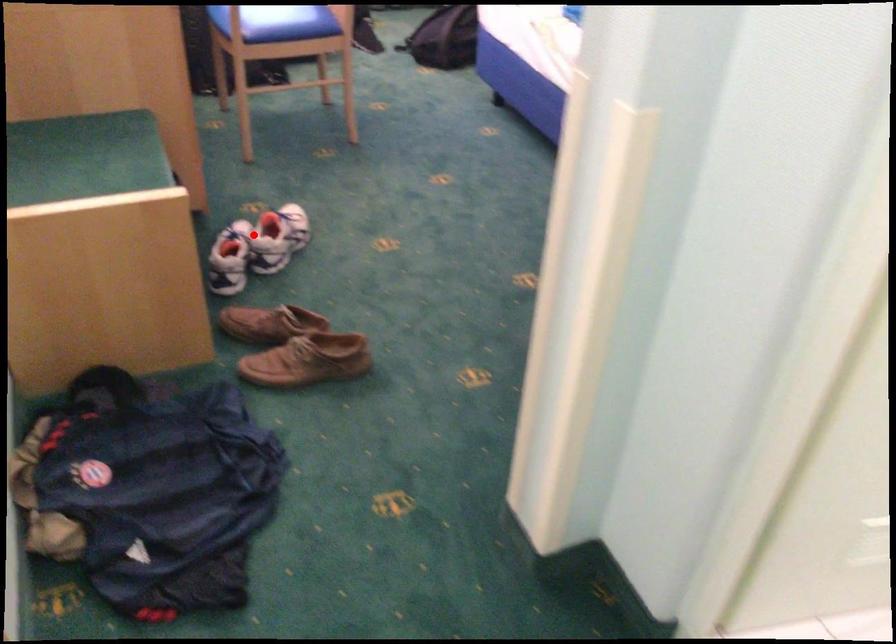
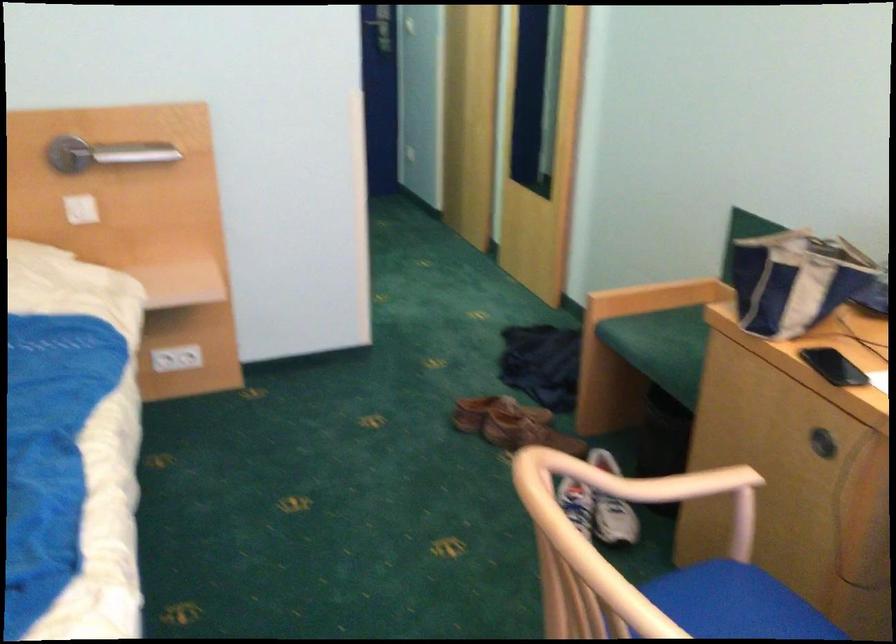
Question: I am providing you with two images of the same scene from different viewpoints. Given a red point in image1, look at the same physical point in image2. Is it:

Choices:
 (A) Closer to the viewpoint
 (B) Farther from the viewpoint

Answer: (A)